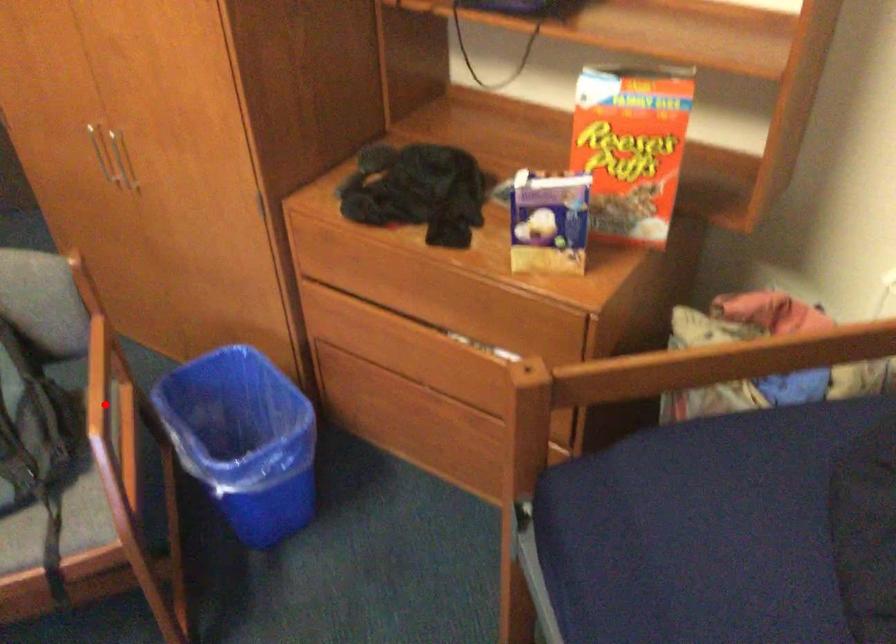
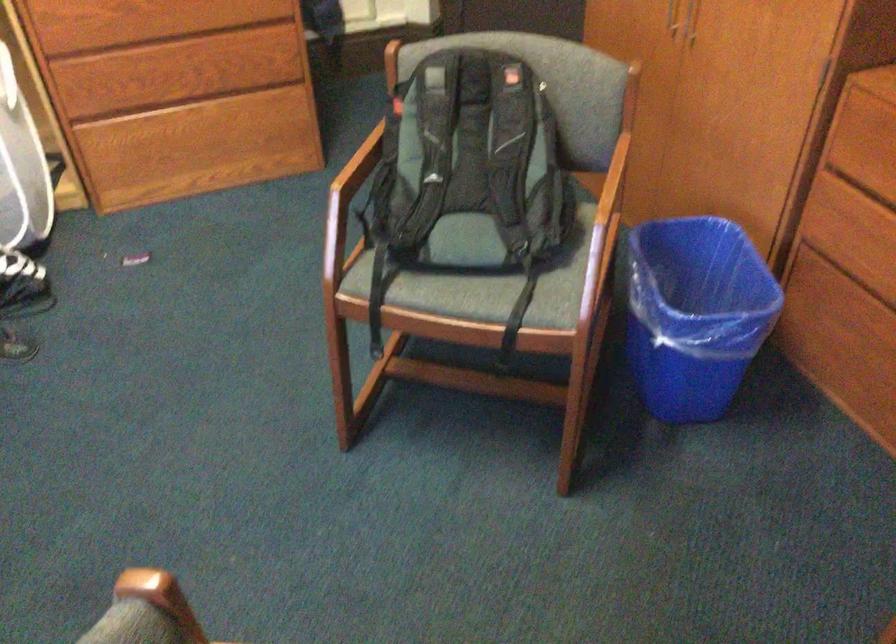
Where in the second image is the point corresponding to the highlighted location from the first image?

(609, 201)